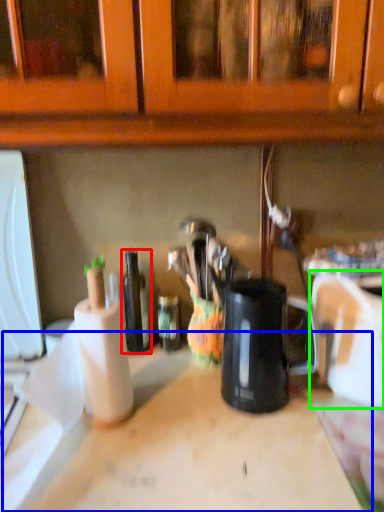
Question: Which is nearer to the bottle (highlighted by a red box)? counter top (highlighted by a blue box) or appliance (highlighted by a green box).

Choices:
 (A) counter top
 (B) appliance

Answer: (A)